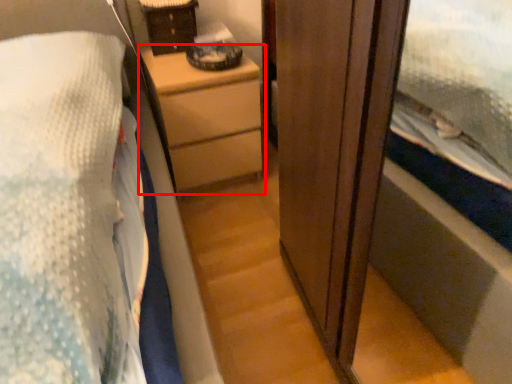
Question: Where is chest of drawers (annotated by the red box) located in relation to cabinetry in the image?

Choices:
 (A) left
 (B) right

Answer: (B)